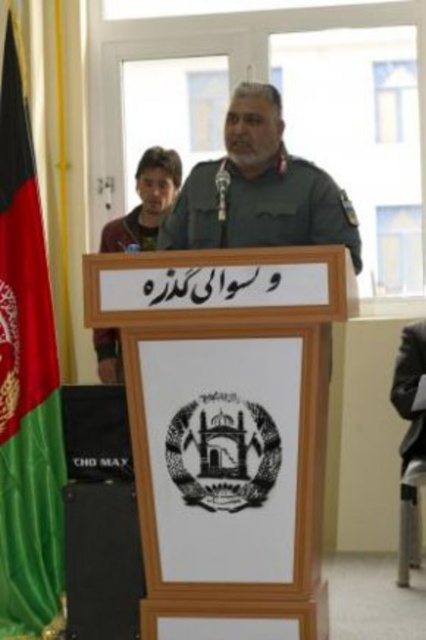
Question: Is green fabric flag at left to the right of green military uniform at center from the viewer's perspective?

Choices:
 (A) yes
 (B) no

Answer: (B)

Question: Which object is the farthest from the green fabric uniform at center?

Choices:
 (A) green fabric flag at left
 (B) gray fabric chair at right

Answer: (B)

Question: Observing the image, what is the correct spatial positioning of green fabric flag at left in reference to gray fabric chair at right?

Choices:
 (A) left
 (B) right

Answer: (A)

Question: Which object is closer to the camera taking this photo?

Choices:
 (A) gray fabric chair at right
 (B) green fabric uniform at center
 (C) green military uniform at center

Answer: (C)

Question: Does green fabric flag at left have a lesser width compared to green military uniform at center?

Choices:
 (A) no
 (B) yes

Answer: (B)

Question: Which of these objects is positioned farthest from the green military uniform at center?

Choices:
 (A) green fabric flag at left
 (B) green fabric uniform at center

Answer: (B)